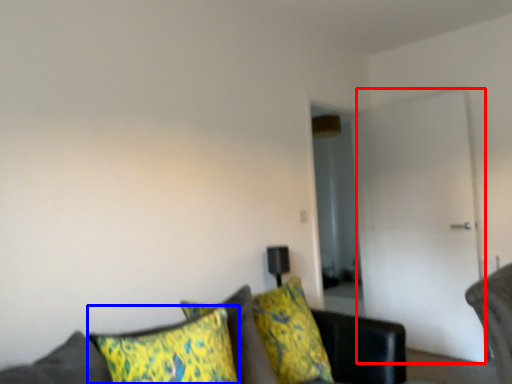
Question: Which of the following is the closest to the observer, glass door (highlighted by a red box) or pillow (highlighted by a blue box)?

Choices:
 (A) glass door
 (B) pillow

Answer: (B)